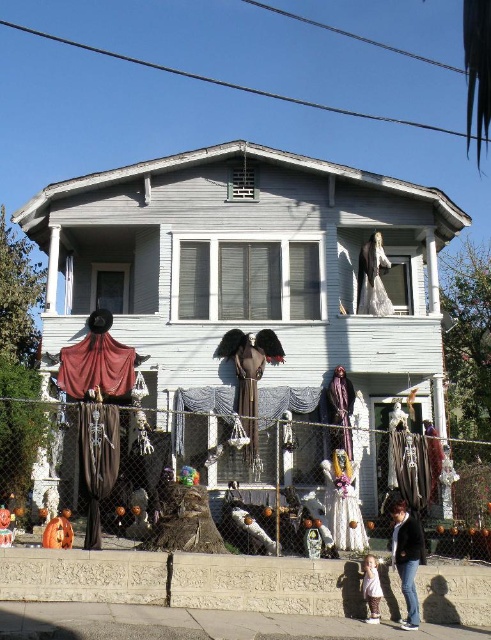
Question: Which object appears farthest from the camera in this image?

Choices:
 (A) black leather jacket at lower right
 (B) metal chain-link fence at lower center

Answer: (B)

Question: Can you confirm if metal chain-link fence at lower center is thinner than black leather jacket at lower right?

Choices:
 (A) yes
 (B) no

Answer: (B)

Question: Does black leather jacket at lower right appear under light pink fabric dress at lower center?

Choices:
 (A) no
 (B) yes

Answer: (A)

Question: Estimate the real-world distances between objects in this image. Which object is farther from the black leather jacket at lower right?

Choices:
 (A) metal chain-link fence at lower center
 (B) light pink fabric dress at lower center

Answer: (A)

Question: Which object is closer to the camera taking this photo?

Choices:
 (A) black leather jacket at lower right
 (B) light pink fabric dress at lower center
 (C) metal chain-link fence at lower center

Answer: (A)

Question: Where is metal chain-link fence at lower center located in relation to light pink fabric dress at lower center in the image?

Choices:
 (A) right
 (B) left

Answer: (B)